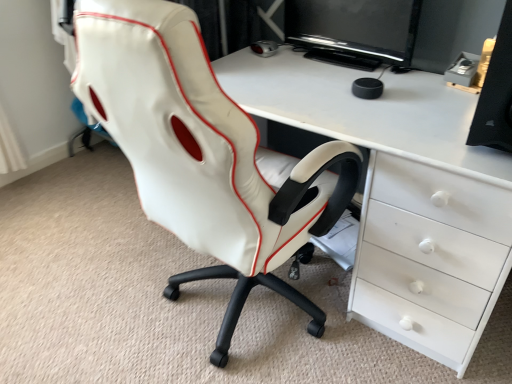
Question: From a real-world perspective, does black matte speaker at right stand above black glossy monitor at upper center?

Choices:
 (A) yes
 (B) no

Answer: (A)

Question: Is black matte speaker at right far away from black glossy monitor at upper center?

Choices:
 (A) no
 (B) yes

Answer: (A)

Question: From the image's perspective, would you say black matte speaker at right is positioned over black glossy monitor at upper center?

Choices:
 (A) no
 (B) yes

Answer: (A)

Question: Is black matte speaker at right bigger than black glossy monitor at upper center?

Choices:
 (A) no
 (B) yes

Answer: (B)

Question: From the image's perspective, is black matte speaker at right under black glossy monitor at upper center?

Choices:
 (A) no
 (B) yes

Answer: (B)

Question: Does black matte speaker at right come behind black glossy monitor at upper center?

Choices:
 (A) yes
 (B) no

Answer: (B)

Question: From the image's perspective, is black glossy monitor at upper center on white glossy desk at center?

Choices:
 (A) yes
 (B) no

Answer: (A)

Question: Is black glossy monitor at upper center at the right side of white glossy desk at center?

Choices:
 (A) no
 (B) yes

Answer: (A)

Question: From the image's perspective, would you say black glossy monitor at upper center is shown under white glossy desk at center?

Choices:
 (A) yes
 (B) no

Answer: (B)

Question: Is the position of black glossy monitor at upper center more distant than that of white glossy desk at center?

Choices:
 (A) yes
 (B) no

Answer: (A)

Question: Is black glossy monitor at upper center positioned before white glossy desk at center?

Choices:
 (A) yes
 (B) no

Answer: (B)

Question: Is black glossy monitor at upper center not close to white glossy desk at center?

Choices:
 (A) yes
 (B) no

Answer: (B)

Question: From the image's perspective, does black matte speaker at right appear higher than white glossy desk at center?

Choices:
 (A) yes
 (B) no

Answer: (A)